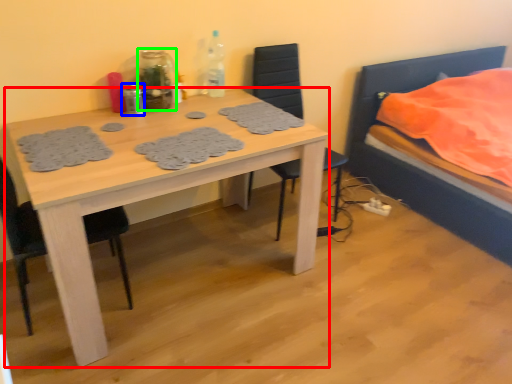
Question: Considering the real-world distances, which object is farthest from kitchen & dining room table (highlighted by a red box)? bottle (highlighted by a blue box) or bottle (highlighted by a green box)?

Choices:
 (A) bottle
 (B) bottle

Answer: (A)